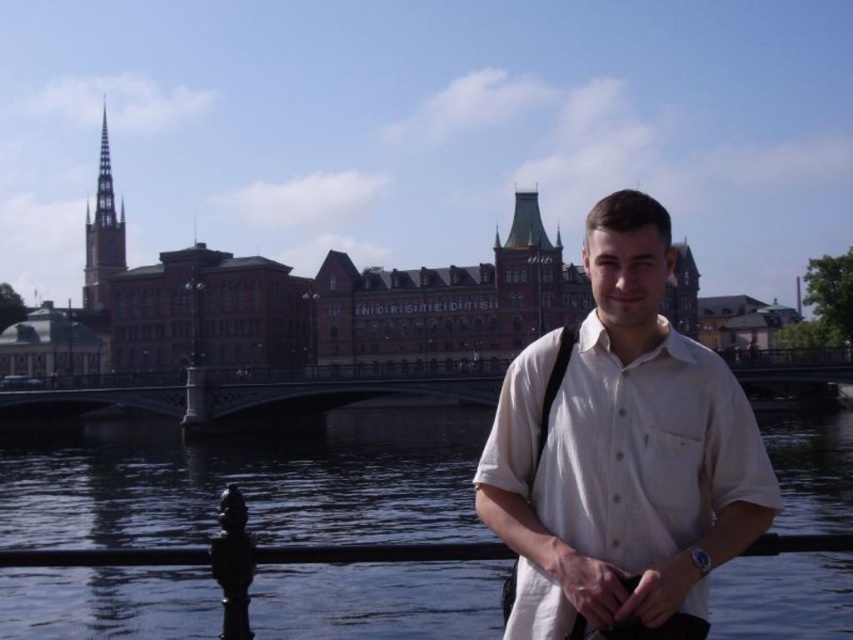
Question: Estimate the real-world distances between objects in this image. Which object is farther from the black metal rail at lower center?

Choices:
 (A) white cotton shirt at center
 (B) transparent glass water at center

Answer: (B)

Question: Is the position of transparent glass water at center more distant than that of white cotton shirt at center?

Choices:
 (A) yes
 (B) no

Answer: (A)

Question: Which object is farther from the camera taking this photo?

Choices:
 (A) white cotton shirt at center
 (B) black metal rail at lower center
 (C) transparent glass water at center

Answer: (C)

Question: Can you confirm if transparent glass water at center is positioned to the left of white cotton shirt at center?

Choices:
 (A) no
 (B) yes

Answer: (B)

Question: Where is transparent glass water at center located in relation to black metal rail at lower center in the image?

Choices:
 (A) left
 (B) right

Answer: (B)

Question: Which point is farther to the camera?

Choices:
 (A) (206, 524)
 (B) (548, 540)
 (C) (178, 548)

Answer: (A)